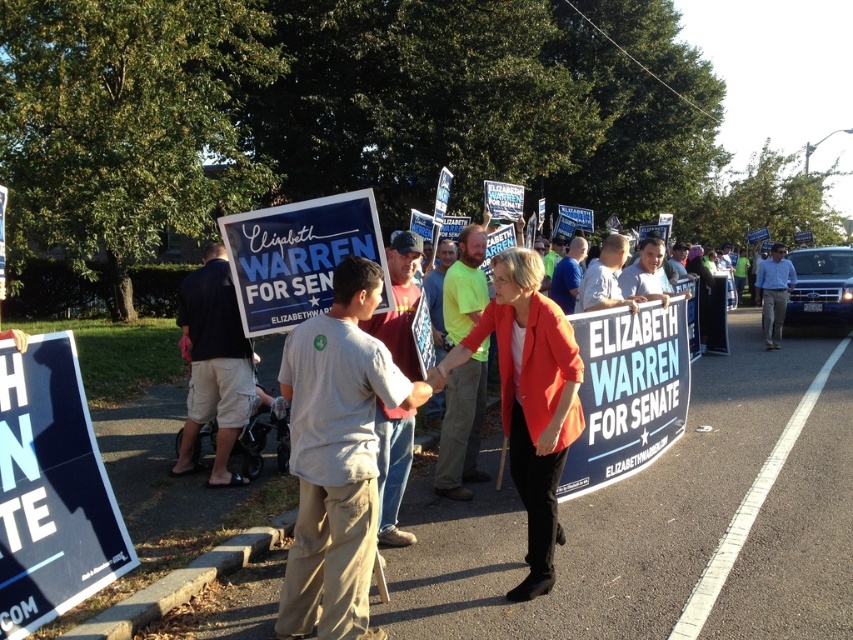
Is gray cotton t-shirt at center positioned behind light blue shirt at center?

That is False.

Between gray cotton t-shirt at center and light blue shirt at center, which one is positioned lower?

gray cotton t-shirt at center is lower down.

At what (x,y) coordinates should I click in order to perform the action: click on gray cotton t-shirt at center. Please return your answer as a coordinate pair (x, y). This screenshot has width=853, height=640. Looking at the image, I should click on coord(337,456).

From the picture: Can you confirm if gray cotton t-shirt at center is positioned to the right of dark blue fabric sign at center?

Indeed, gray cotton t-shirt at center is positioned on the right side of dark blue fabric sign at center.

Who is more forward, (323, 628) or (229, 285)?

Point (323, 628) is more forward.

Find the location of `gray cotton t-shirt at center`. gray cotton t-shirt at center is located at coordinates (337, 456).

Does matte red blazer at center appear on the right side of light blue shirt at center?

Incorrect, matte red blazer at center is not on the right side of light blue shirt at center.

Who is higher up, matte red blazer at center or light blue shirt at center?

light blue shirt at center

Describe the element at coordinates (531, 397) in the screenshot. The image size is (853, 640). I see `matte red blazer at center` at that location.

I want to click on matte red blazer at center, so click(531, 397).